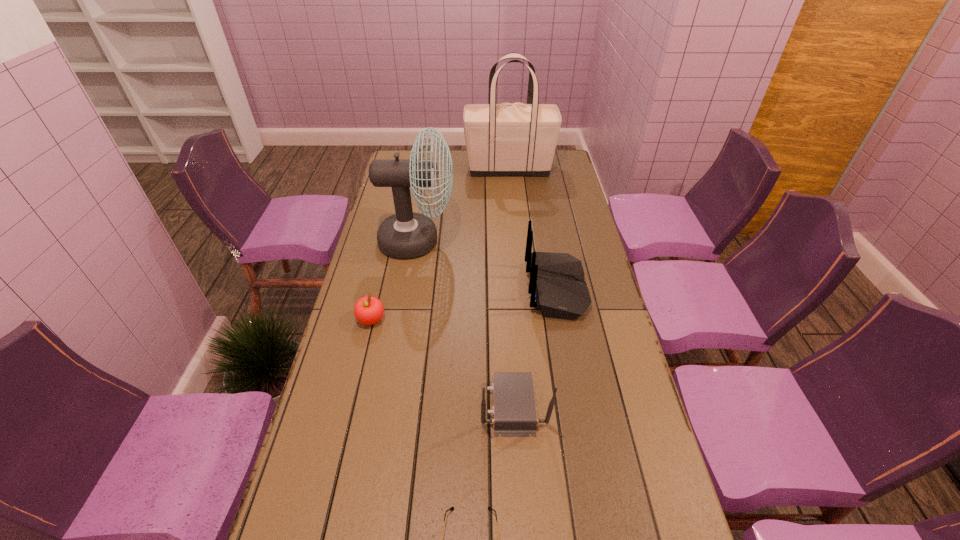
In order to click on shopping bag in this screenshot , I will do `click(517, 139)`.

Find the location of a particular element. fan is located at coordinates (406, 234).

Find the location of a particular element. This screenshot has width=960, height=540. the nearer router is located at coordinates (514, 408).

Locate an element on the screen. the farther router is located at coordinates (557, 287).

The height and width of the screenshot is (540, 960). In order to click on apple in this screenshot , I will do `click(368, 310)`.

Locate an element on the screen. This screenshot has width=960, height=540. free space located 0.190m with handles facing forward on the shopping bag is located at coordinates (424, 168).

You are a GUI agent. You are given a task and a screenshot of the screen. Output one action in this format:
    pyautogui.click(x=<x>, y=<y>)
    Task: Click on the vacant space located with handles facing forward on the shopping bag
    This screenshot has width=960, height=540.
    Given the screenshot: What is the action you would take?
    pyautogui.click(x=433, y=168)

Where is `free region located with handles facing forward on the shopping bag`? The image size is (960, 540). free region located with handles facing forward on the shopping bag is located at coordinates (445, 168).

Where is `vacant space positioned in front of the fan where the airflow is directed`? Image resolution: width=960 pixels, height=540 pixels. vacant space positioned in front of the fan where the airflow is directed is located at coordinates (508, 241).

Identify the location of blank area located on the back of the nearer router to connect cables. (436, 404).